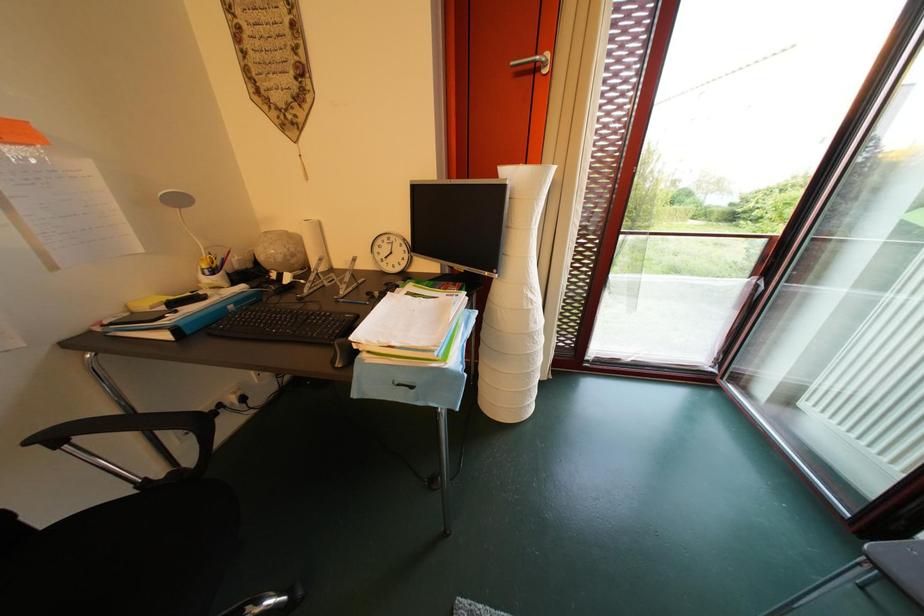
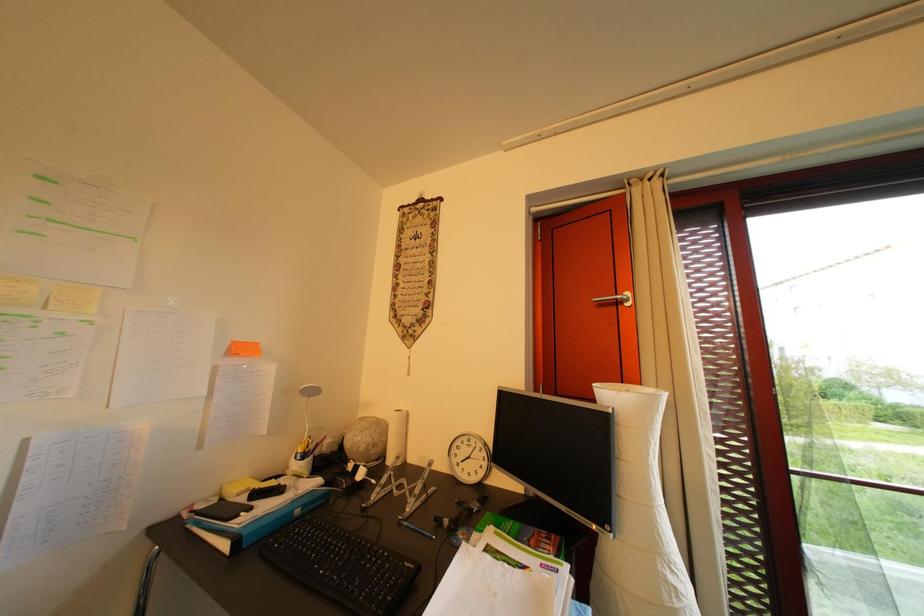
The first image is from the beginning of the video and the second image is from the end. How did the camera likely rotate when shooting the video?

The camera rotated toward left-up.